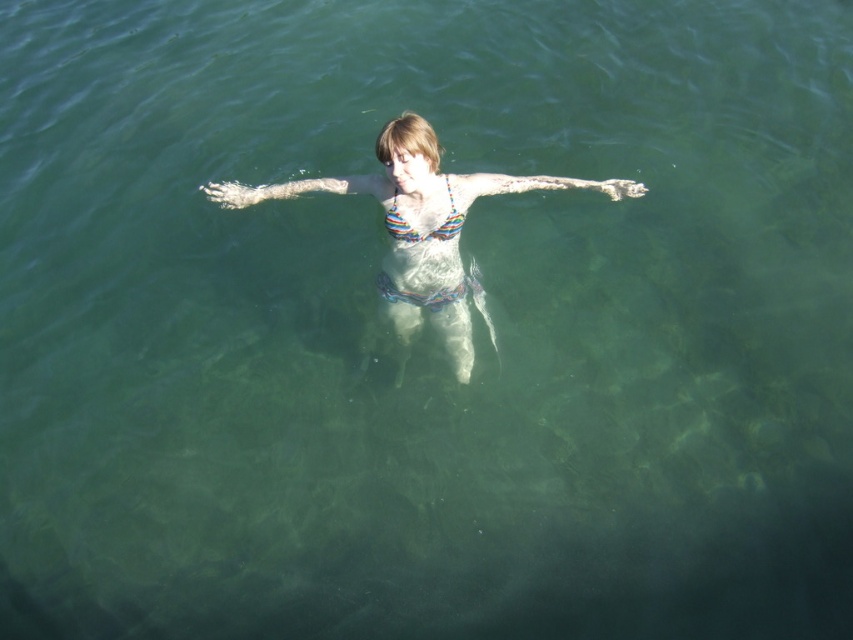
Question: Can you confirm if white matte skin at center is positioned above rainbow striped bikini top at center?

Choices:
 (A) no
 (B) yes

Answer: (B)

Question: Which point is closer to the camera taking this photo?

Choices:
 (A) (315, 189)
 (B) (392, 221)

Answer: (B)

Question: Is multicolored bikini at center further to camera compared to rainbow striped bikini top at center?

Choices:
 (A) no
 (B) yes

Answer: (A)

Question: Where is multicolored bikini at center located in relation to white matte skin at center in the image?

Choices:
 (A) above
 (B) below

Answer: (B)

Question: Which object is positioned farthest from the white matte skin at center?

Choices:
 (A) rainbow striped bikini top at center
 (B) multicolored bikini at center

Answer: (A)

Question: Which point is farther from the camera taking this photo?

Choices:
 (A) (227, 188)
 (B) (387, 225)
 (C) (474, 184)

Answer: (A)